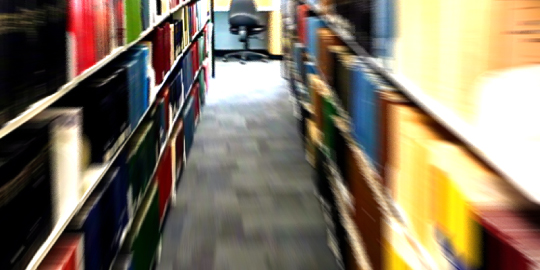
The image size is (540, 270). Find the location of `white books`. white books is located at coordinates (72, 154), (511, 134).